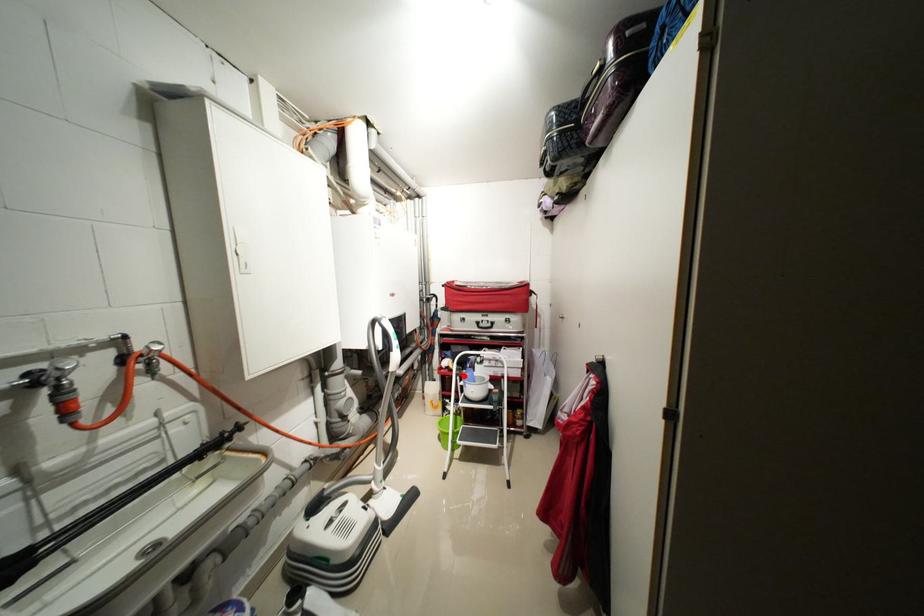
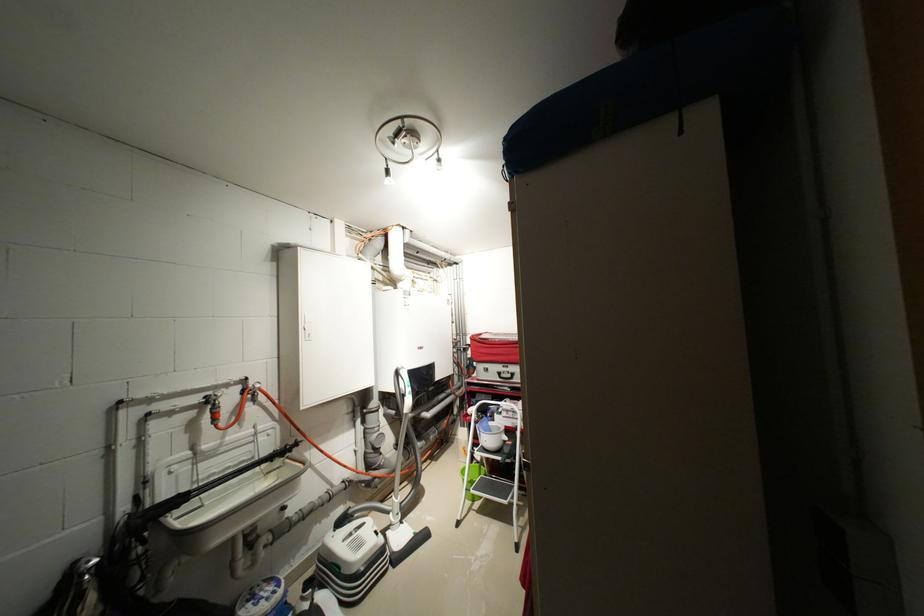
Question: I am providing you with two images of the same scene from different viewpoints. A red point is shown in image1. For the corresponding object point in image2, is it positioned nearer or farther from the camera?

Choices:
 (A) Nearer
 (B) Farther

Answer: (B)